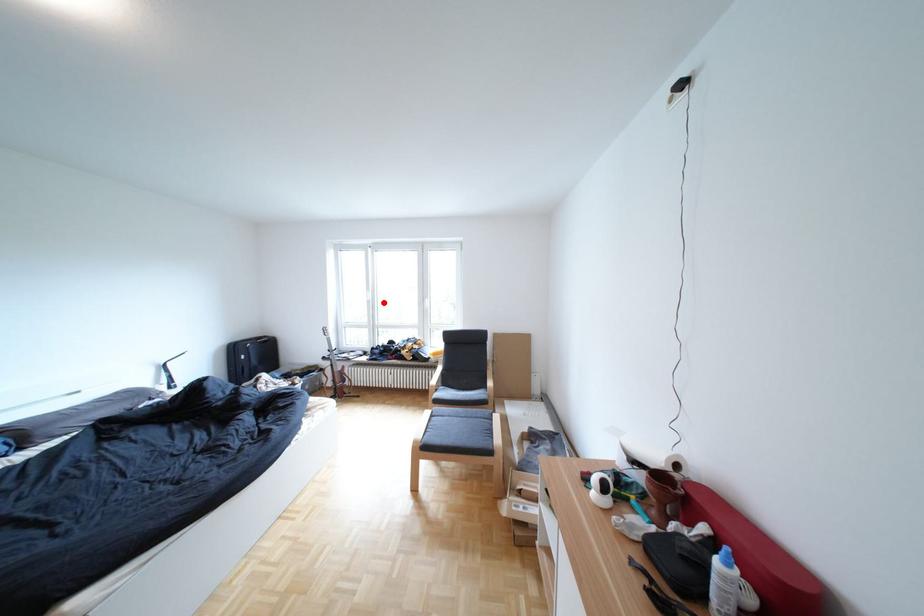
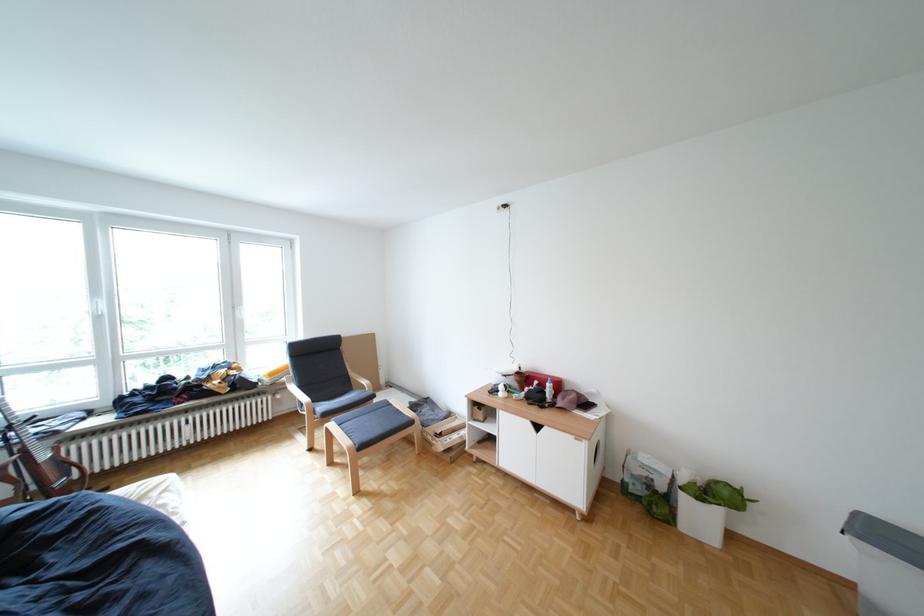
Locate, in the second image, the point that corresponds to the highlighted location in the first image.

(114, 318)